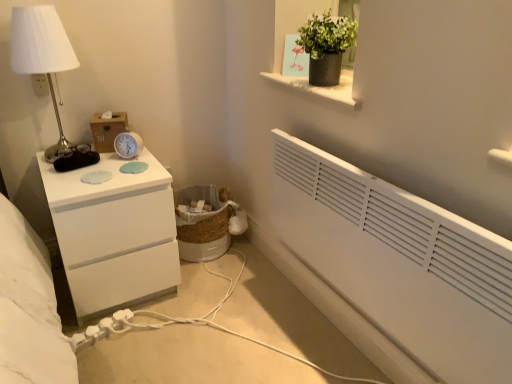
Find the location of `free spot in front of woven natural laundry basket at lower center`. free spot in front of woven natural laundry basket at lower center is located at coordinates (217, 286).